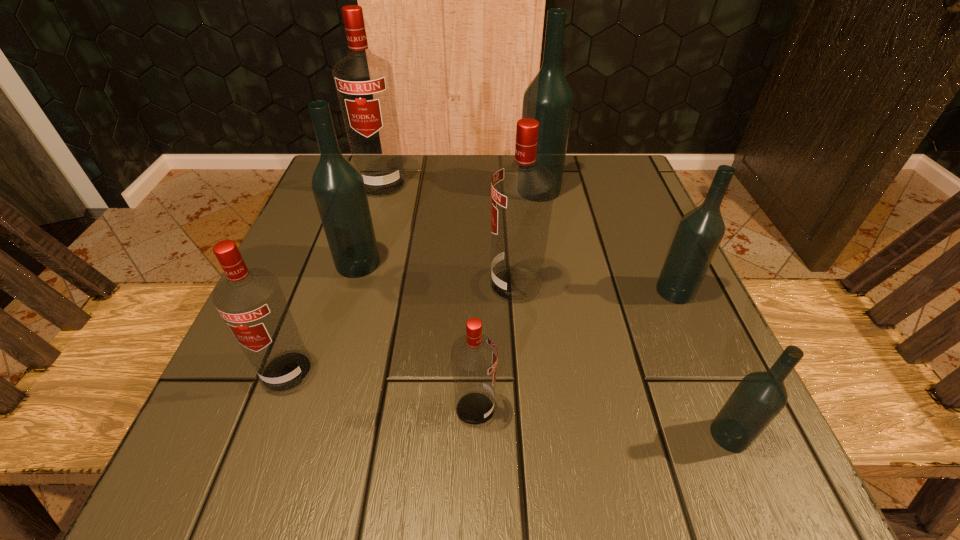
Locate an element on the screen. The height and width of the screenshot is (540, 960). object located in the far left corner section of the desktop is located at coordinates (364, 83).

This screenshot has width=960, height=540. I want to click on object at the near right corner, so pyautogui.click(x=760, y=396).

In the image, there is a desktop. Identify the location of free space at the far edge. The width and height of the screenshot is (960, 540). (417, 169).

Where is `free space at the near edge of the desktop`? The image size is (960, 540). free space at the near edge of the desktop is located at coordinates (489, 434).

The image size is (960, 540). In the image, there is a desktop. Identify the location of free space at the left edge. (316, 377).

Where is `blank space at the right edge of the desktop`? blank space at the right edge of the desktop is located at coordinates (610, 245).

The image size is (960, 540). Find the location of `vacant space at the far left corner of the desktop`. vacant space at the far left corner of the desktop is located at coordinates (384, 199).

At what (x,y) coordinates should I click in order to perform the action: click on blank space at the far right corner of the desktop. Please return your answer as a coordinate pair (x, y). The width and height of the screenshot is (960, 540). Looking at the image, I should click on (612, 176).

You are a GUI agent. You are given a task and a screenshot of the screen. Output one action in this format:
    pyautogui.click(x=<x>, y=<y>)
    Task: Click on the free space between the biggest red vodka and the second black vodka from left to right
    
    Given the screenshot: What is the action you would take?
    pyautogui.click(x=460, y=187)

You are a GUI agent. You are given a task and a screenshot of the screen. Output one action in this format:
    pyautogui.click(x=<x>, y=<y>)
    Task: Click on the unoccupied area between the smallest red vodka and the leftmost black vodka
    The width and height of the screenshot is (960, 540).
    Given the screenshot: What is the action you would take?
    pyautogui.click(x=417, y=336)